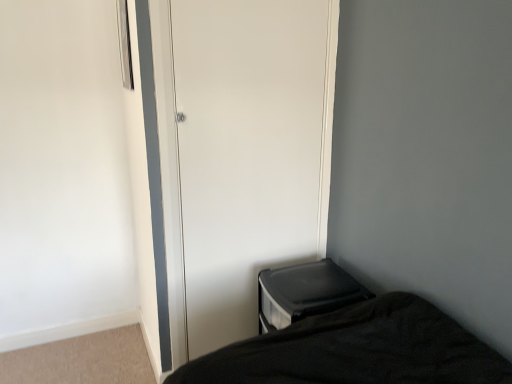
At what (x,y) coordinates should I click in order to perform the action: click on vacant area on top of black plastic changing table at lower right (from a real-world perspective). Please return your answer as a coordinate pair (x, y). This screenshot has height=384, width=512. Looking at the image, I should click on (318, 286).